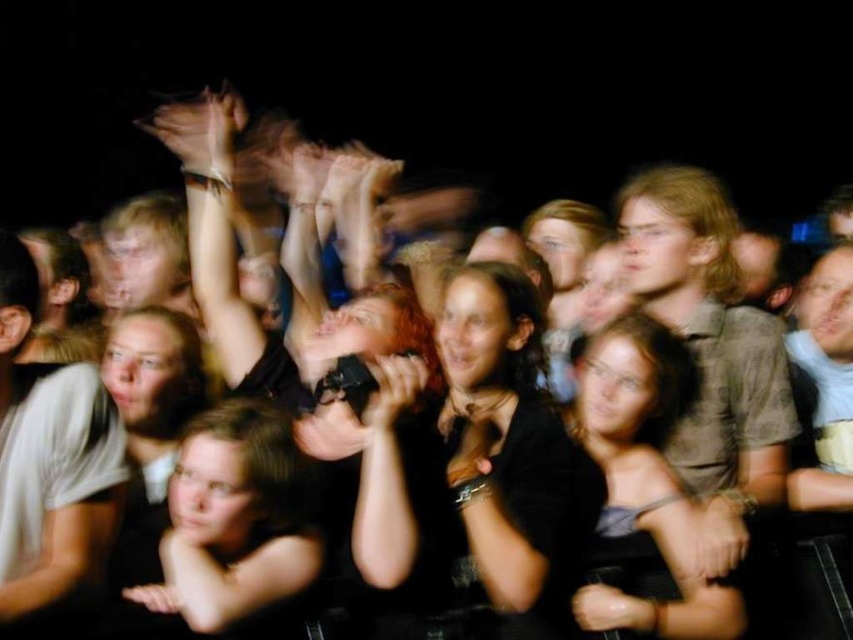
Question: Does black matte microphone at center have a larger size compared to black matte shirt at center?

Choices:
 (A) yes
 (B) no

Answer: (A)

Question: Can you confirm if black fabric shirt at center is thinner than black matte shirt at center?

Choices:
 (A) no
 (B) yes

Answer: (B)

Question: Which object is closer to the camera taking this photo?

Choices:
 (A) black matte shirt at center
 (B) translucent skin hand at upper center

Answer: (A)

Question: Can you confirm if light brown hair at center is smaller than translucent skin hand at upper center?

Choices:
 (A) no
 (B) yes

Answer: (A)

Question: Which is nearer to the black matte shirt at center?

Choices:
 (A) black matte microphone at center
 (B) light brown hair at center
 (C) dark gray fabric dress at center

Answer: (A)

Question: Which object is positioned closest to the black matte shirt at center?

Choices:
 (A) light brown hair at center
 (B) dark gray fabric dress at center
 (C) black matte microphone at center

Answer: (C)